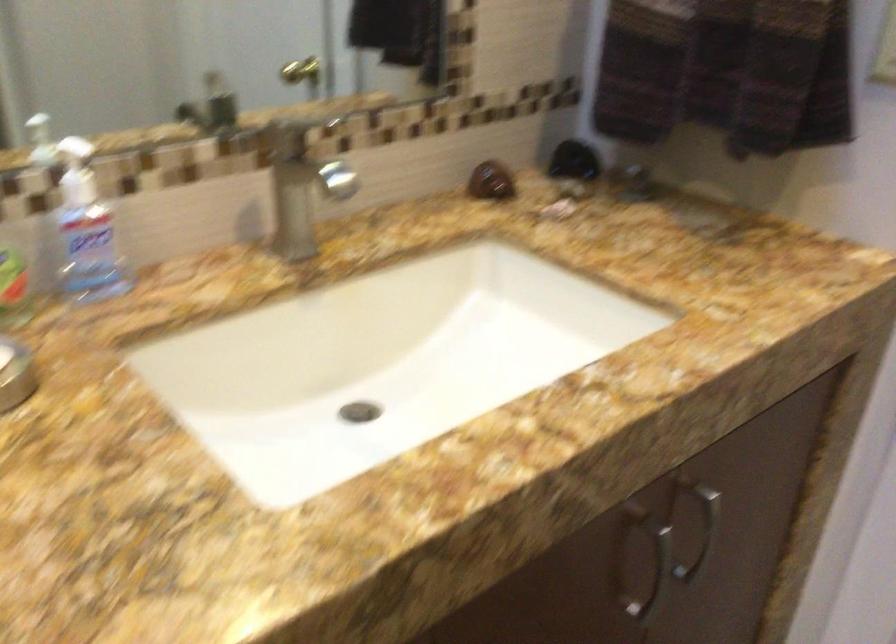
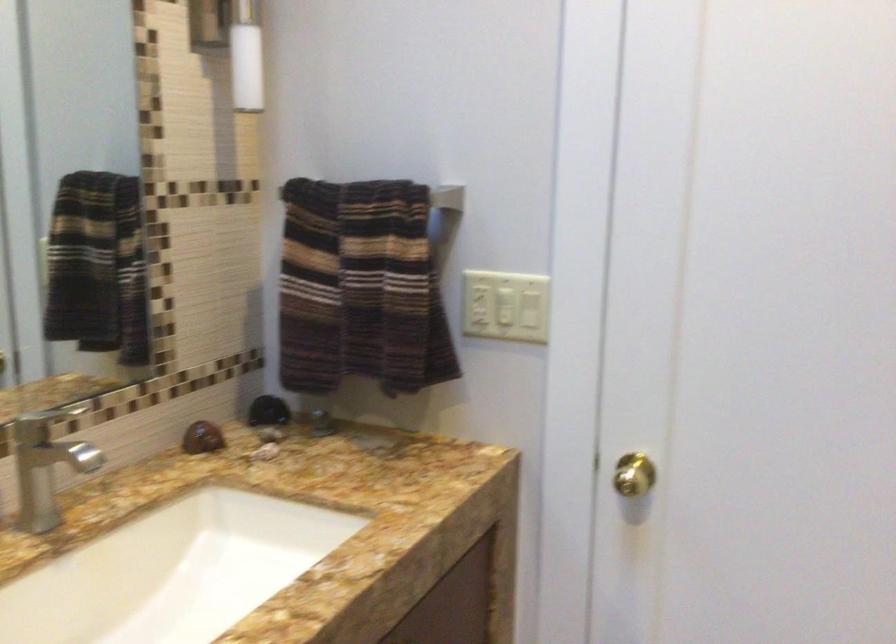
Question: How did the camera likely rotate?

Choices:
 (A) Left
 (B) Right
 (C) Up
 (D) Down

Answer: (B)